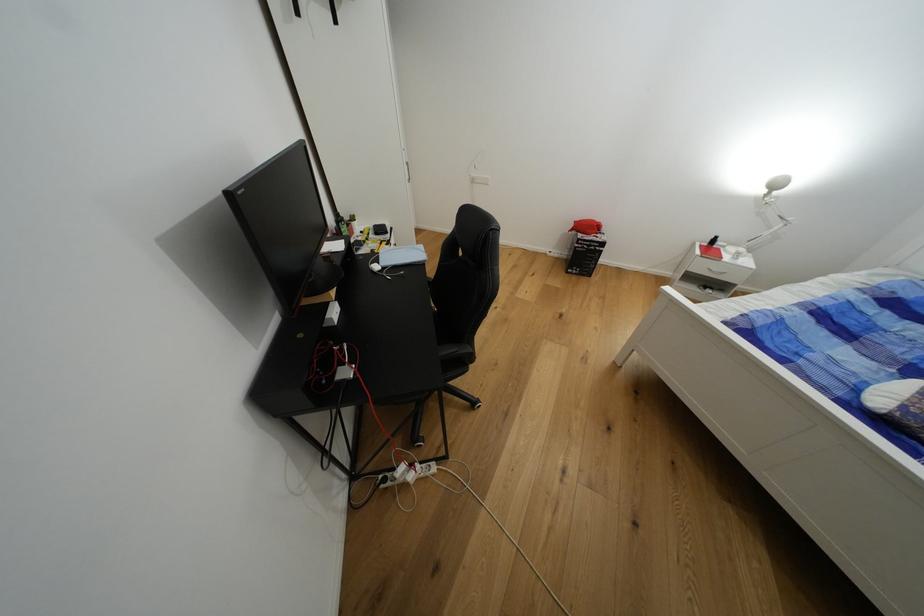
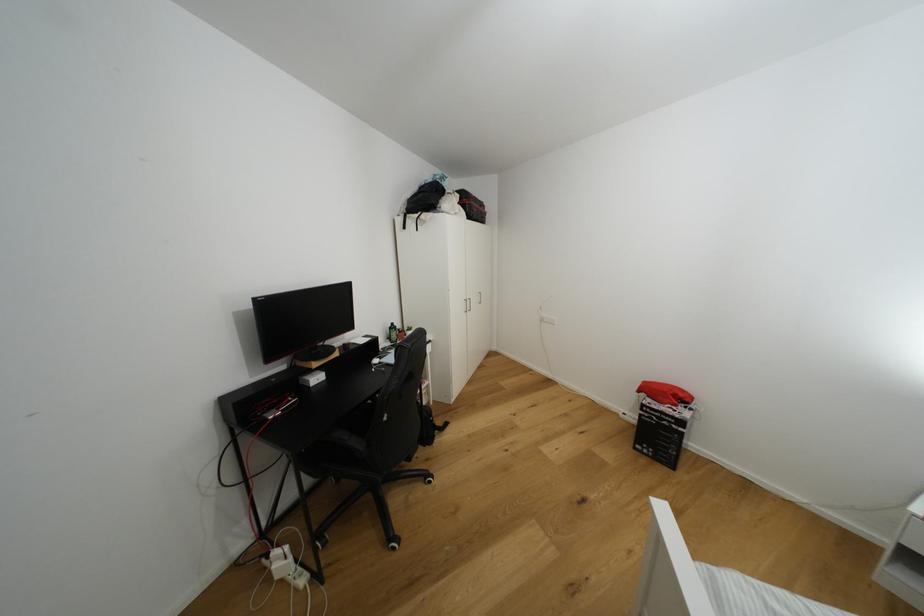
In the second image, find the point that corresponds to point (573, 274) in the first image.

(639, 450)